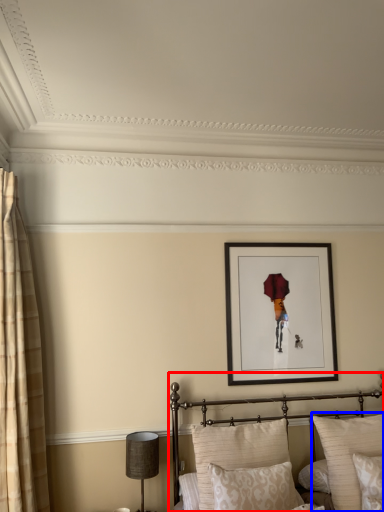
Question: Which point is closer to the camera, bed (highlighted by a red box) or pillow (highlighted by a blue box)?

Choices:
 (A) bed
 (B) pillow

Answer: (A)